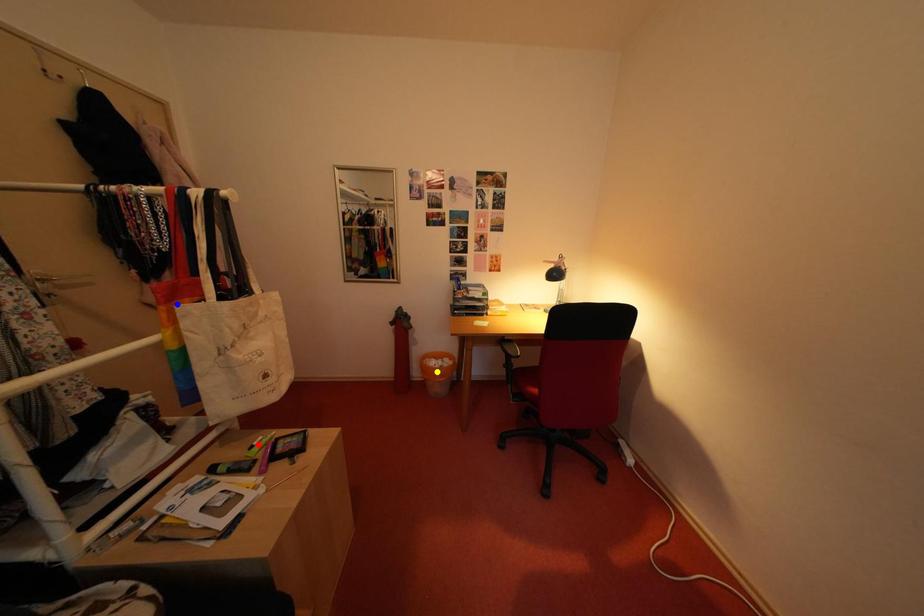
From the picture: Order these from nearest to farthest:
A) yellow point
B) blue point
C) red point

1. blue point
2. red point
3. yellow point